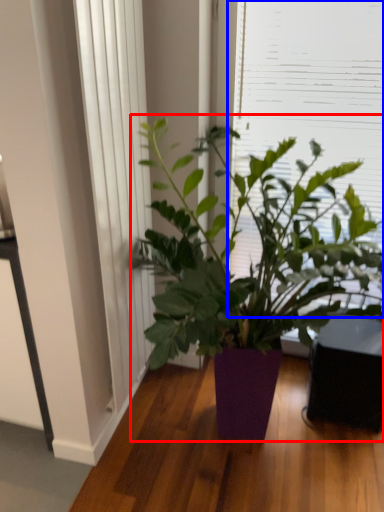
Question: Among these objects, which one is nearest to the camera, houseplant (highlighted by a red box) or window screen (highlighted by a blue box)?

Choices:
 (A) houseplant
 (B) window screen

Answer: (A)